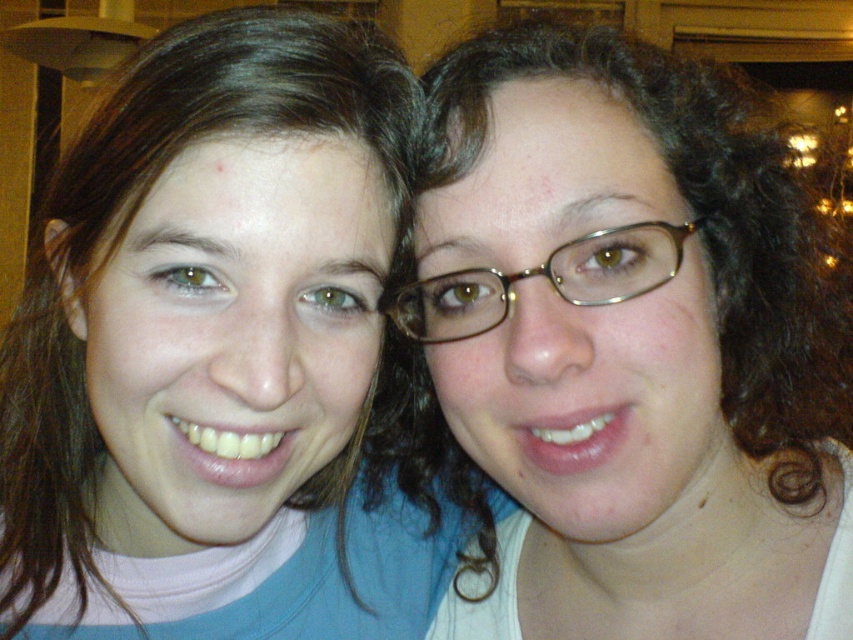
Who is taller, matte pink shirt at left or gold metallic glasses at center?

Standing taller between the two is matte pink shirt at left.

Is point (119, 108) closer to viewer compared to point (641, 262)?

That is False.

Where is `matte pink shirt at left`? matte pink shirt at left is located at coordinates (219, 355).

Which is behind, point (207, 298) or point (456, 412)?

The point (456, 412) is more distant.

Is point (155, 188) positioned before point (688, 432)?

That is True.

Identify the location of matte pink shirt at left. This screenshot has height=640, width=853. (x=219, y=355).

Is matte brown hair at right thinner than gold metallic glasses at center?

In fact, matte brown hair at right might be wider than gold metallic glasses at center.

Which of these two, matte brown hair at right or gold metallic glasses at center, stands taller?

matte brown hair at right is taller.

You are a GUI agent. You are given a task and a screenshot of the screen. Output one action in this format:
    pyautogui.click(x=<x>, y=<y>)
    Task: Click on the matte brown hair at right
    The image size is (853, 640).
    Given the screenshot: What is the action you would take?
    pyautogui.click(x=625, y=348)